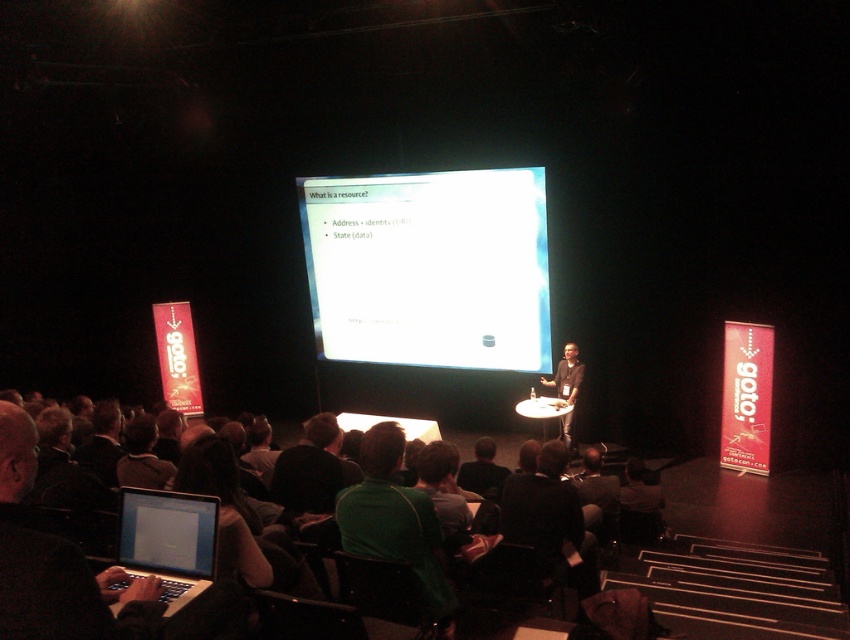
Question: Among these points, which one is nearest to the camera?

Choices:
 (A) (578, 371)
 (B) (366, 362)
 (C) (293, 502)
 (D) (180, 557)

Answer: (D)

Question: Which of the following is the farthest from the observer?

Choices:
 (A) black glossy laptop at lower left
 (B) dark green fabric seats at lower center

Answer: (A)

Question: Among these points, which one is farthest from the camera?

Choices:
 (A) (570, 396)
 (B) (17, 449)

Answer: (A)

Question: Can you confirm if matte black laptop at lower left is wider than dark brown shirt at center?

Choices:
 (A) yes
 (B) no

Answer: (A)

Question: Can you confirm if black glossy laptop at lower left is bigger than dark brown shirt at center?

Choices:
 (A) no
 (B) yes

Answer: (A)

Question: Is matte black laptop at lower left in front of dark brown shirt at center?

Choices:
 (A) yes
 (B) no

Answer: (A)